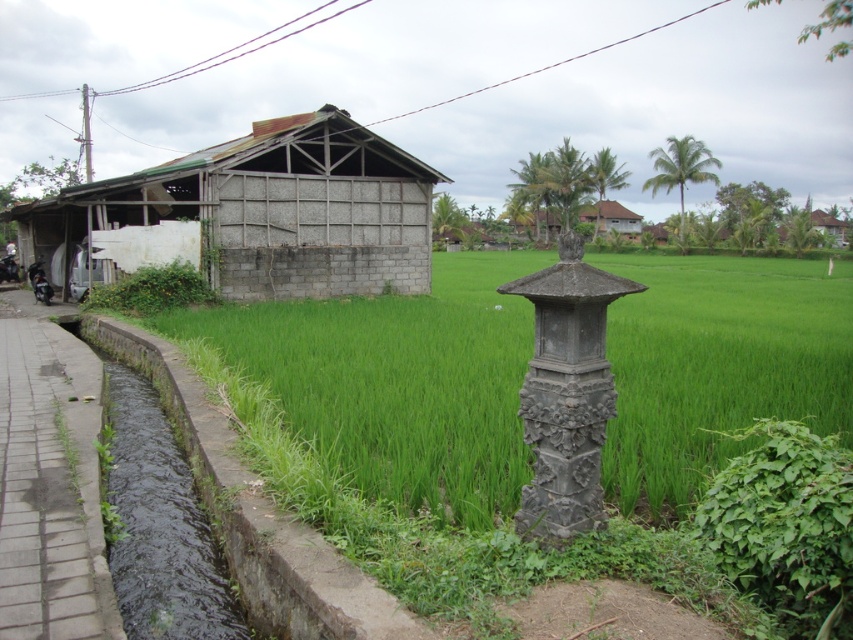
You are a farmer walking along the canal and see the green grass at center and the brown thatched roof hut at center. Which one is closer to you?

The green grass at center is closer to you because it is in front of the brown thatched roof hut at center.

You are standing on the paved walkway next to the narrow water canal. You see the green grass at center and the brown thatched roof hut at center. Which object is positioned to the left when facing the rice field?

The green grass at center is to the left of the brown thatched roof hut at center when facing the rice field.

You are a farmer standing at the entrance of the rice field. You need to determine which structure is taller between the rusty corrugated metal hut at left and the dark gray concrete at left. Which one is taller?

The rusty corrugated metal hut at left is taller than the dark gray concrete at left according to the description provided.